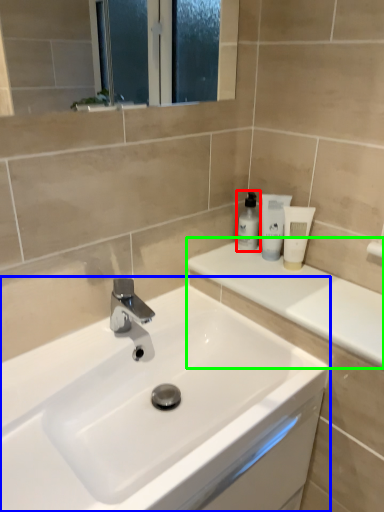
Question: Estimate the real-world distances between objects in this image. Which object is closer to toiletry (highlighted by a red box), sink (highlighted by a blue box) or counter top (highlighted by a green box)?

Choices:
 (A) sink
 (B) counter top

Answer: (B)